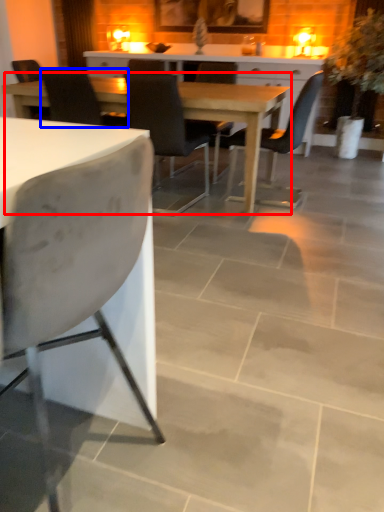
Question: Which of the following is the closest to the observer, kitchen & dining room table (highlighted by a red box) or chair (highlighted by a blue box)?

Choices:
 (A) kitchen & dining room table
 (B) chair

Answer: (A)